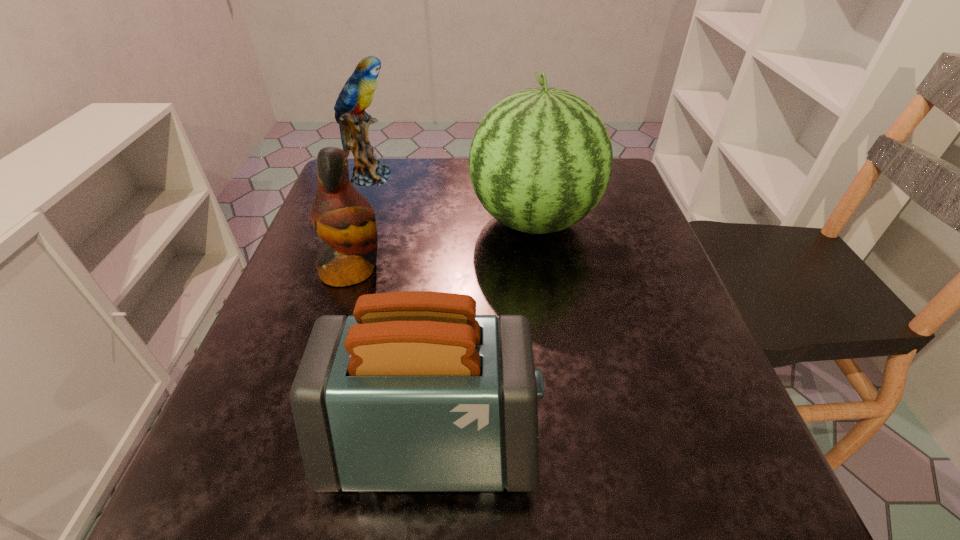
In order to click on watermelon in this screenshot , I will do `click(540, 160)`.

Locate an element on the screen. the farther parrot is located at coordinates (357, 94).

You are a GUI agent. You are given a task and a screenshot of the screen. Output one action in this format:
    pyautogui.click(x=<x>, y=<y>)
    Task: Click on the nearer parrot
    Image resolution: width=960 pixels, height=540 pixels.
    Given the screenshot: What is the action you would take?
    pyautogui.click(x=345, y=221)

This screenshot has height=540, width=960. What are the coordinates of `toaster` in the screenshot? It's located at [414, 392].

You are a GUI agent. You are given a task and a screenshot of the screen. Output one action in this format:
    pyautogui.click(x=<x>, y=<y>)
    Task: Click on the free space located on the left of the watermelon
    This screenshot has height=540, width=960.
    Given the screenshot: What is the action you would take?
    pyautogui.click(x=372, y=221)

Where is `free space located 0.370m on the face of the farther parrot`? The image size is (960, 540). free space located 0.370m on the face of the farther parrot is located at coordinates (540, 177).

The height and width of the screenshot is (540, 960). I want to click on vacant space located on the face of the nearer parrot, so click(x=454, y=270).

You are a GUI agent. You are given a task and a screenshot of the screen. Output one action in this format:
    pyautogui.click(x=<x>, y=<y>)
    Task: Click on the vacant region located 0.260m on the front-facing side of the toaster
    This screenshot has width=960, height=540.
    Given the screenshot: What is the action you would take?
    pyautogui.click(x=719, y=442)

The height and width of the screenshot is (540, 960). Identify the location of watermelon that is at the far edge. (540, 160).

Find the location of a particular element. This screenshot has height=540, width=960. parrot at the far edge is located at coordinates (357, 94).